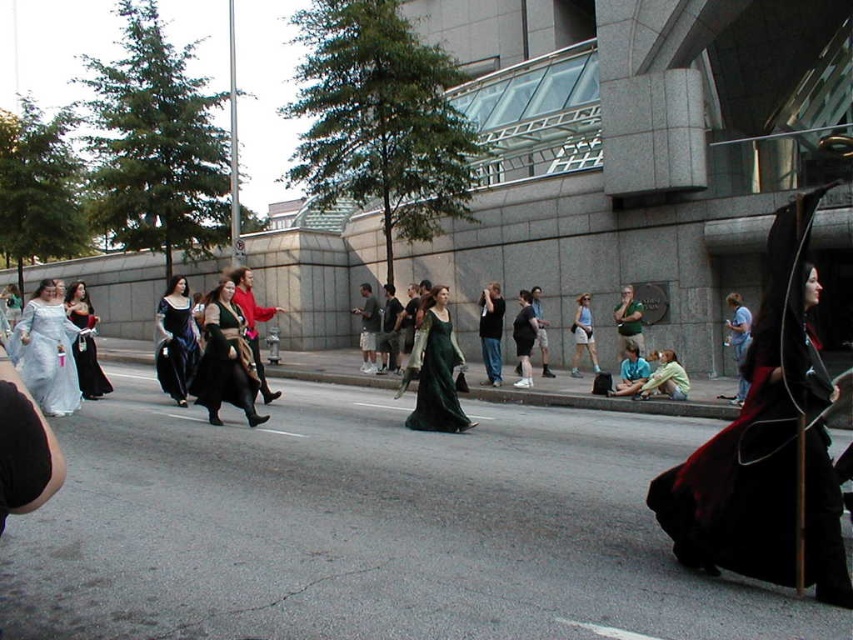
What do you see at coordinates (769, 445) in the screenshot?
I see `velvet black robe at right` at bounding box center [769, 445].

Is point (798, 227) more distant than point (223, 289)?

No, (798, 227) is closer to viewer.

Find the location of a particular element. This screenshot has height=640, width=853. velvet black robe at right is located at coordinates (769, 445).

Who is positioned more to the left, matte white gown at center or green velvet gown at center?

matte white gown at center

Locate an element on the screen. The height and width of the screenshot is (640, 853). matte white gown at center is located at coordinates (47, 352).

Find the location of a particular element. This screenshot has width=853, height=640. matte white gown at center is located at coordinates (47, 352).

Can you confirm if velvet black robe at right is thinner than matte white gown at center?

Yes.

In the scene shown: Is velvet black robe at right behind matte white gown at center?

No, velvet black robe at right is closer to the viewer.

Which is in front, point (718, 460) or point (41, 349)?

Point (718, 460)

At what (x,y) coordinates should I click in order to perform the action: click on velvet black robe at right. Please return your answer as a coordinate pair (x, y). Looking at the image, I should click on (769, 445).